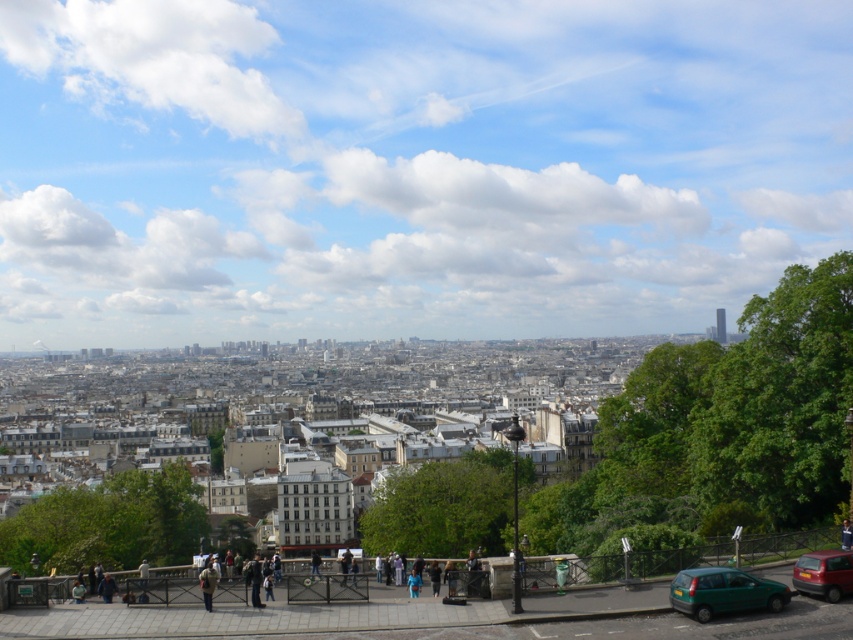
Based on the photo, is matte red car at lower right smaller than shiny metallic tower at upper right?

Yes.

Looking at this image, who is taller, matte red car at lower right or shiny metallic tower at upper right?

shiny metallic tower at upper right

Who is more distant from viewer, (799, 586) or (717, 321)?

Positioned behind is point (717, 321).

In order to click on matte red car at lower right in this screenshot , I will do `click(824, 573)`.

Which is more to the left, green matte car at lower right or matte red car at lower right?

green matte car at lower right

What do you see at coordinates (724, 592) in the screenshot?
I see `green matte car at lower right` at bounding box center [724, 592].

I want to click on green matte car at lower right, so click(x=724, y=592).

Between point (694, 612) and point (718, 339), which one is positioned in front?

Point (694, 612)

Is green matte car at lower right thinner than shiny metallic tower at upper right?

Indeed, green matte car at lower right has a lesser width compared to shiny metallic tower at upper right.

Is point (711, 605) behind point (717, 321)?

That is False.

This screenshot has height=640, width=853. What are the coordinates of `green matte car at lower right` in the screenshot? It's located at pyautogui.click(x=724, y=592).